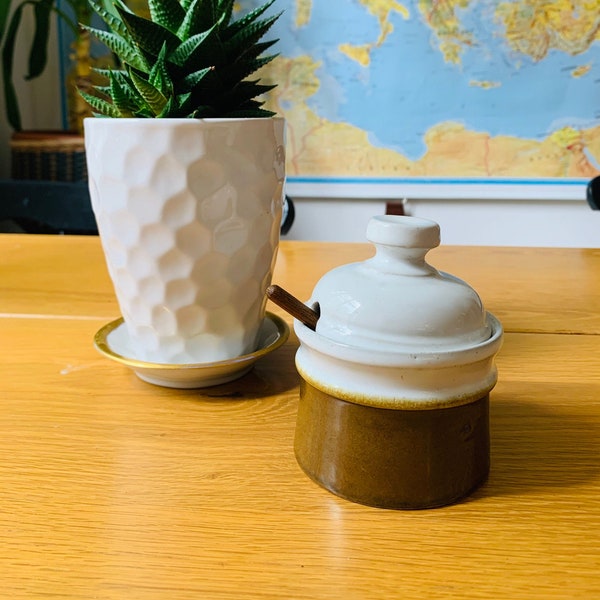
Locate an element on the screen. wall is located at coordinates (507, 218).